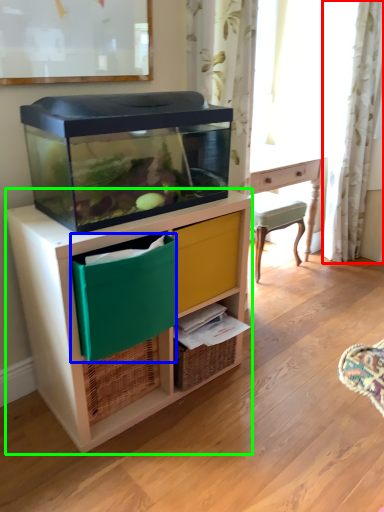
Question: Considering the real-world distances, which object is closest to curtain (highlighted by a red box)? storage box (highlighted by a blue box) or chest of drawers (highlighted by a green box).

Choices:
 (A) storage box
 (B) chest of drawers

Answer: (B)